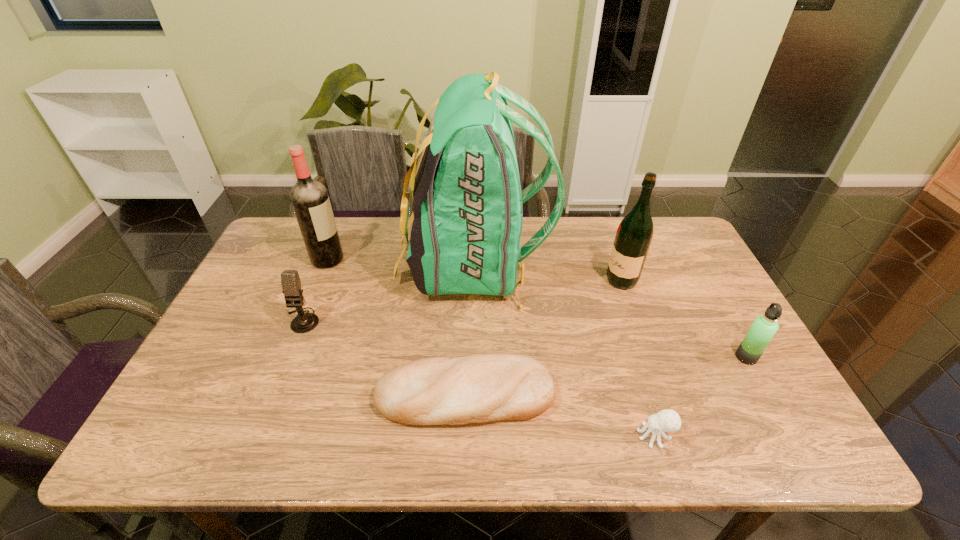
At what (x,y) coordinates should I click in order to perform the action: click on backpack. Please return your answer as a coordinate pair (x, y). The image size is (960, 540). Looking at the image, I should click on (467, 201).

Where is `the farther liquor`? The width and height of the screenshot is (960, 540). the farther liquor is located at coordinates (310, 200).

Identify the location of the nearer liquor. (634, 235).

You are a GUI agent. You are given a task and a screenshot of the screen. Output one action in this format:
    pyautogui.click(x=<x>, y=<y>)
    Task: Click on the thermos bottle
    
    Given the screenshot: What is the action you would take?
    pyautogui.click(x=764, y=327)

I want to click on the third nearest object, so click(x=764, y=327).

Locate an element on the screen. microphone is located at coordinates (305, 322).

In order to click on bread in this screenshot , I will do `click(479, 388)`.

Where is `octopus`? The height and width of the screenshot is (540, 960). octopus is located at coordinates (667, 420).

Locate an element on the screen. The height and width of the screenshot is (540, 960). blank area located 0.220m on the back of the backpack is located at coordinates (617, 265).

This screenshot has height=540, width=960. Identify the location of free region located 0.220m on the front-facing side of the farther liquor. (413, 259).